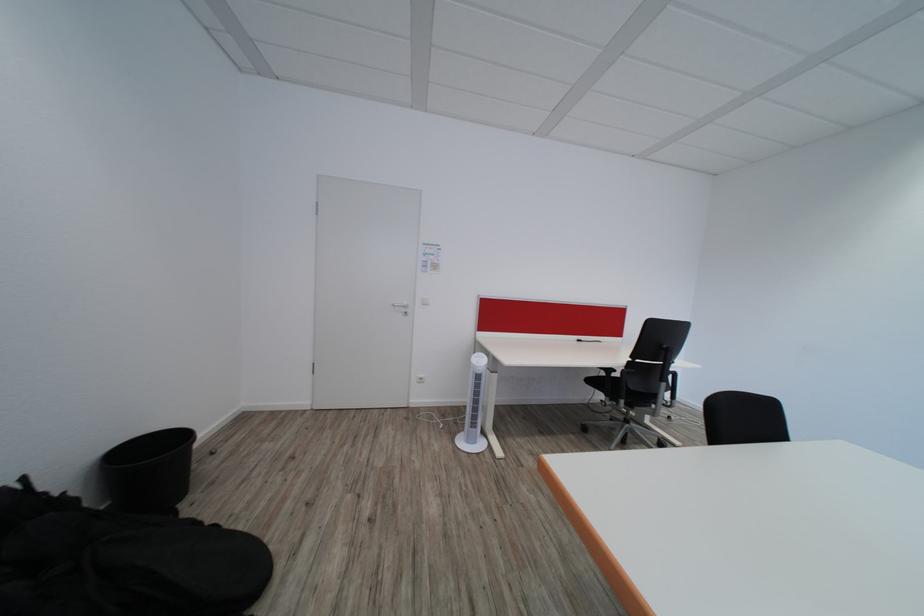
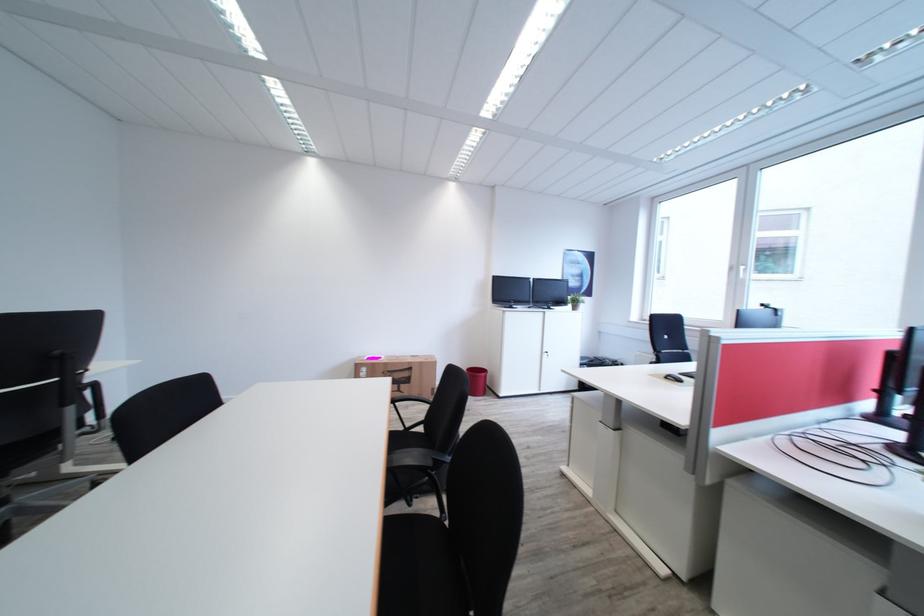
Question: Based on the continuous images, in which direction is the camera rotating? Reply with the corresponding letter.

Choices:
 (A) Left
 (B) Right
 (C) Up
 (D) Down

Answer: (B)